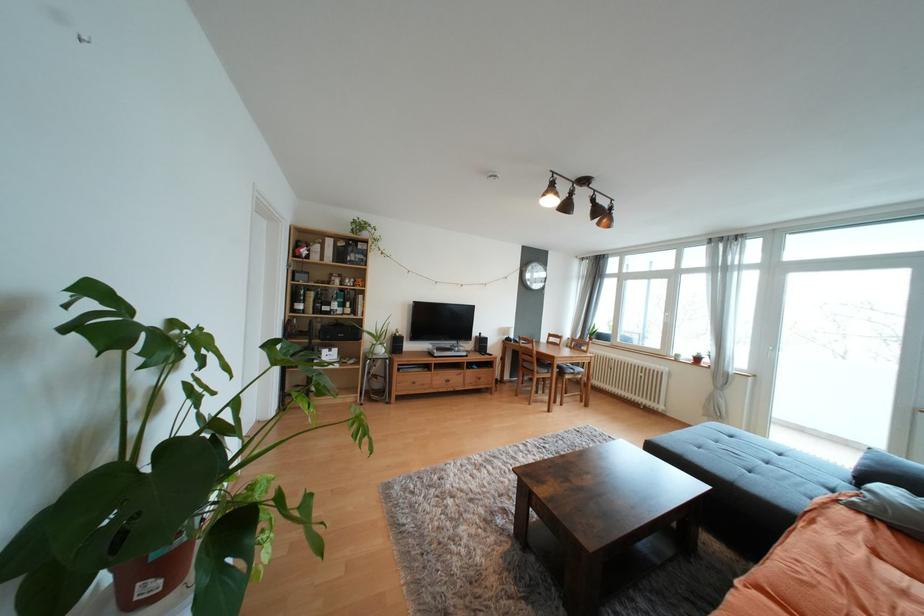
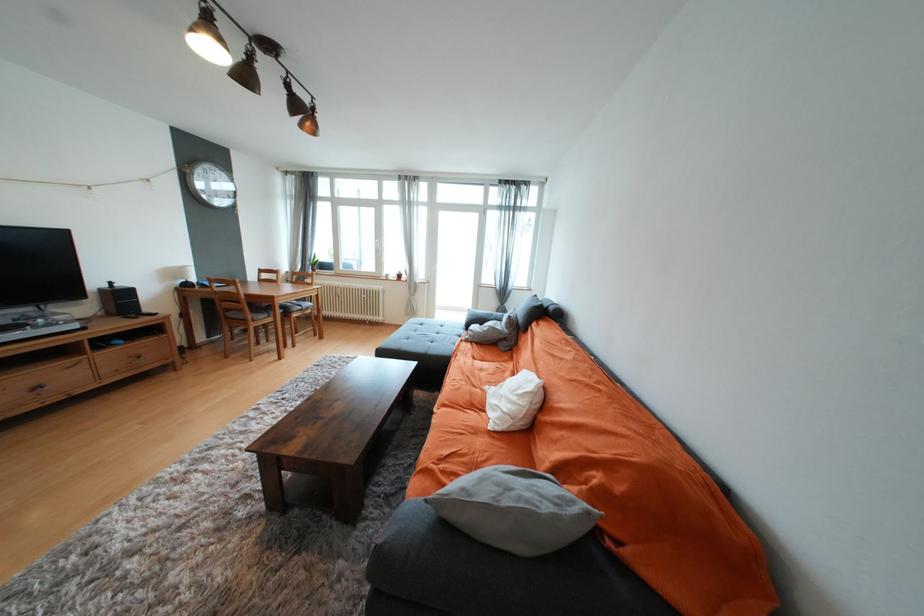
Locate, in the second image, the point that corresponds to point (649, 371) in the first image.

(371, 293)